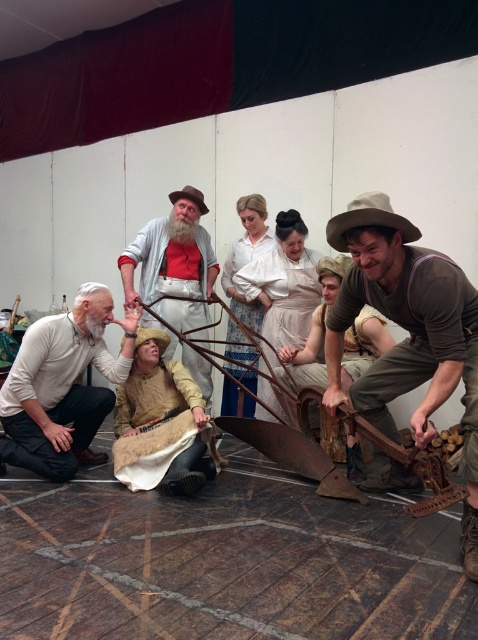
Can you confirm if white matte shirt at lower left is thinner than white cotton blouse at center?

In fact, white matte shirt at lower left might be wider than white cotton blouse at center.

Who is positioned more to the left, white matte shirt at lower left or white cotton blouse at center?

From the viewer's perspective, white matte shirt at lower left appears more on the left side.

Where is `white matte shirt at lower left`? Image resolution: width=478 pixels, height=640 pixels. white matte shirt at lower left is located at coordinates (63, 387).

The width and height of the screenshot is (478, 640). Describe the element at coordinates (160, 422) in the screenshot. I see `knitted beige sweater at center` at that location.

Is point (196, 465) closer to camera compared to point (245, 404)?

Yes, it is in front of point (245, 404).

Is point (150, 449) farther from camera compared to point (250, 324)?

That is False.

This screenshot has width=478, height=640. Identify the location of knitted beige sweater at center. (160, 422).

Who is positioned more to the right, brown canvas hat at center or light beige cotton dress at center?

From the viewer's perspective, brown canvas hat at center appears more on the right side.

Is the position of brown canvas hat at center less distant than that of light beige cotton dress at center?

Yes.

Is point (427, 356) less distant than point (267, 344)?

Yes.

This screenshot has height=640, width=478. What are the coordinates of `brown canvas hat at center` in the screenshot? It's located at (410, 333).